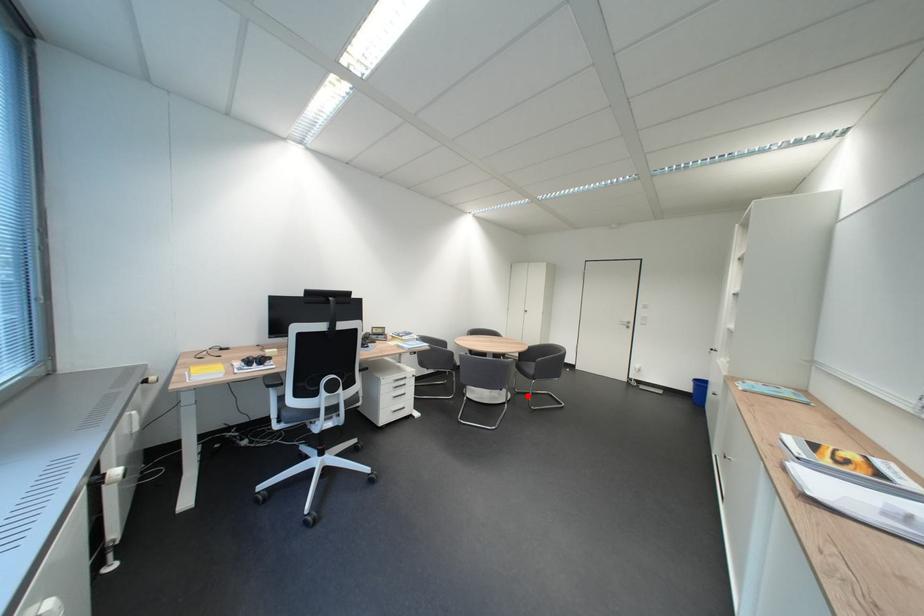
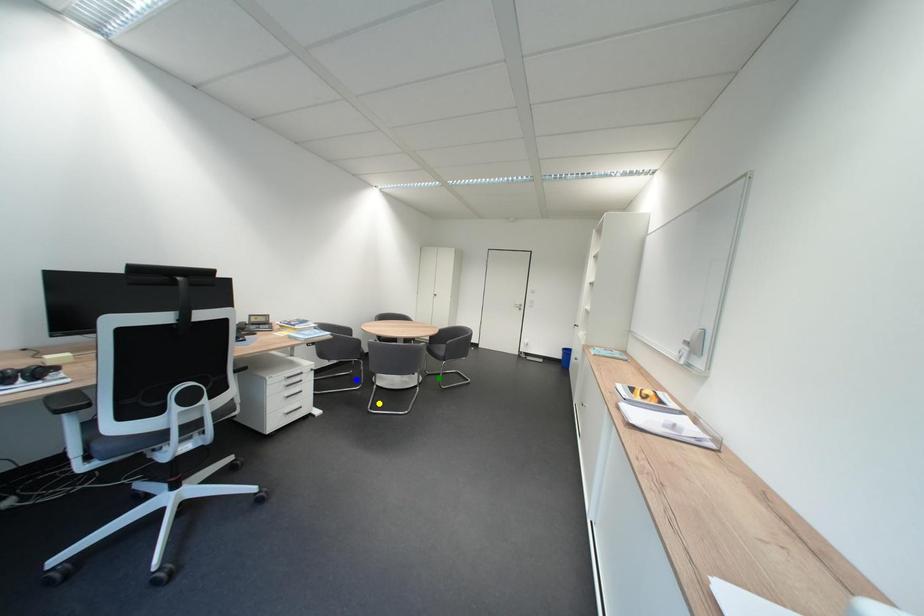
Question: I am providing you with two images of the same scene from different viewpoints. A red point is marked on the first image. You are given multiple points on the second image. Which point in image 2 is actually the same real-world point as the red point in image 1?

Choices:
 (A) green point
 (B) blue point
 (C) yellow point

Answer: (A)